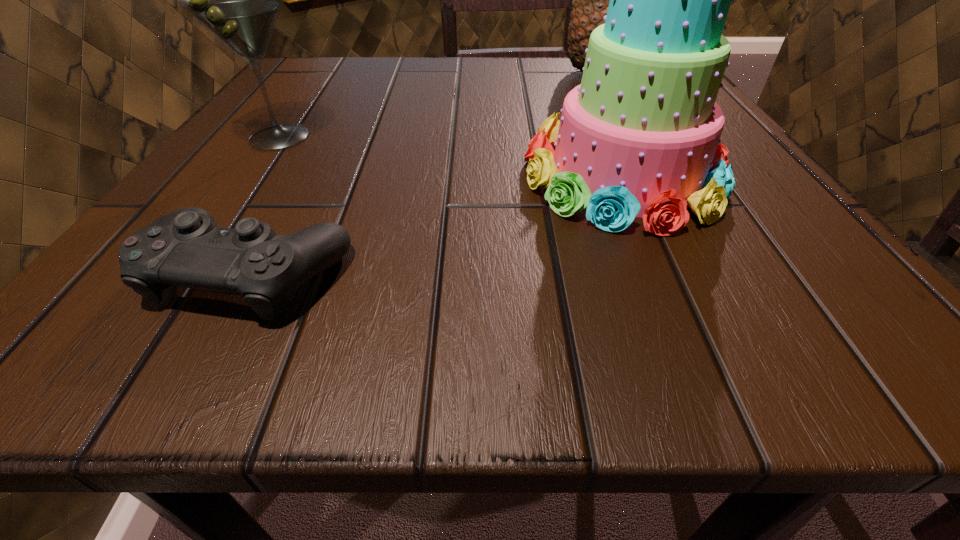
Where is `pineapple`? Image resolution: width=960 pixels, height=540 pixels. pineapple is located at coordinates (590, 3).

You are a GUI agent. You are given a task and a screenshot of the screen. Output one action in this format:
    pyautogui.click(x=<x>, y=<y>)
    Task: Click on the tallest object
    This screenshot has height=540, width=960.
    Given the screenshot: What is the action you would take?
    pyautogui.click(x=590, y=3)

Image resolution: width=960 pixels, height=540 pixels. I want to click on cake, so click(640, 136).

You are a GUI agent. You are given a task and a screenshot of the screen. Output one action in this format:
    pyautogui.click(x=<x>, y=<y>)
    Task: Click on the martini
    The image size is (960, 540).
    Given the screenshot: What is the action you would take?
    pyautogui.click(x=238, y=0)

Find the location of a particular element. The width and height of the screenshot is (960, 540). the shortest object is located at coordinates (186, 248).

In order to click on free region located on the left of the farthest object in this screenshot , I will do `click(379, 73)`.

What are the coordinates of `free space located 0.360m on the left of the cake` in the screenshot? It's located at (251, 174).

Locate an element on the screen. free location located 0.280m on the back of the martini is located at coordinates (334, 58).

Locate an element on the screen. The height and width of the screenshot is (540, 960). free space located 0.380m on the back of the shortest object is located at coordinates 348,94.

Image resolution: width=960 pixels, height=540 pixels. Identify the location of object that is at the far edge. pos(590,3).